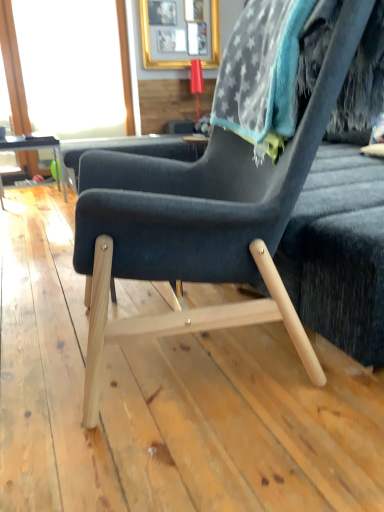
Question: Does matte black table at left have a larger size compared to dark blue fabric chair at center?

Choices:
 (A) yes
 (B) no

Answer: (B)

Question: Can you confirm if matte black table at left is taller than dark blue fabric chair at center?

Choices:
 (A) yes
 (B) no

Answer: (B)

Question: Is matte black table at left in front of dark blue fabric chair at center?

Choices:
 (A) no
 (B) yes

Answer: (A)

Question: Is dark blue fabric chair at center at the back of matte black table at left?

Choices:
 (A) yes
 (B) no

Answer: (B)

Question: Is dark blue fabric chair at center a part of matte black table at left?

Choices:
 (A) no
 (B) yes

Answer: (A)

Question: Is matte black table at left bigger or smaller than gray fuzzy bean bag at upper right?

Choices:
 (A) small
 (B) big

Answer: (B)

Question: In terms of width, does matte black table at left look wider or thinner when compared to gray fuzzy bean bag at upper right?

Choices:
 (A) thin
 (B) wide

Answer: (B)

Question: Does point (54, 159) appear closer or farther from the camera than point (236, 36)?

Choices:
 (A) closer
 (B) farther

Answer: (B)

Question: Which is correct: matte black table at left is inside gray fuzzy bean bag at upper right, or outside of it?

Choices:
 (A) outside
 (B) inside

Answer: (A)

Question: Visually, is gray fuzzy bean bag at upper right positioned to the left or to the right of transparent glass window screen at upper left?

Choices:
 (A) right
 (B) left

Answer: (A)

Question: In the image, is gray fuzzy bean bag at upper right positioned in front of or behind transparent glass window screen at upper left?

Choices:
 (A) front
 (B) behind

Answer: (A)

Question: Looking at the image, does gray fuzzy bean bag at upper right seem bigger or smaller compared to transparent glass window screen at upper left?

Choices:
 (A) small
 (B) big

Answer: (A)

Question: From their relative heights in the image, would you say gray fuzzy bean bag at upper right is taller or shorter than transparent glass window screen at upper left?

Choices:
 (A) tall
 (B) short

Answer: (B)

Question: From a real-world perspective, relative to transparent glass window screen at upper left, is dark blue fabric chair at center vertically above or below?

Choices:
 (A) above
 (B) below

Answer: (B)

Question: Does point (157, 323) appear closer or farther from the camera than point (132, 110)?

Choices:
 (A) farther
 (B) closer

Answer: (B)